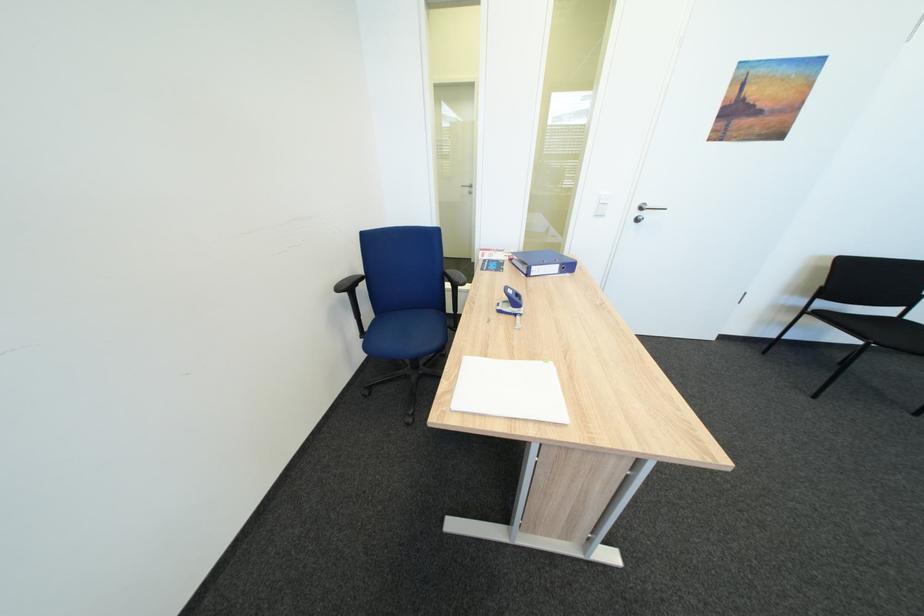
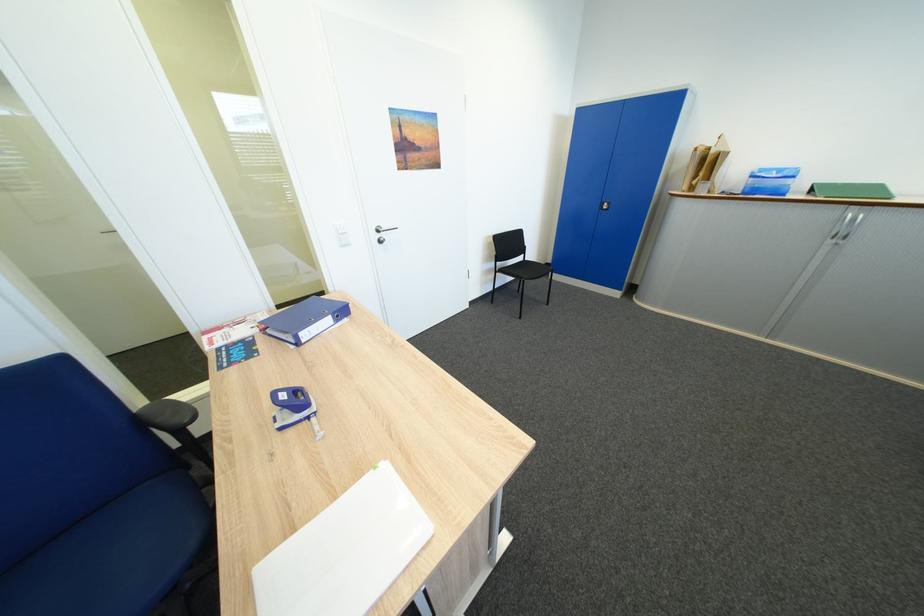
In the second image, find the point that corresponds to the point at 543,269 in the first image.

(310, 334)